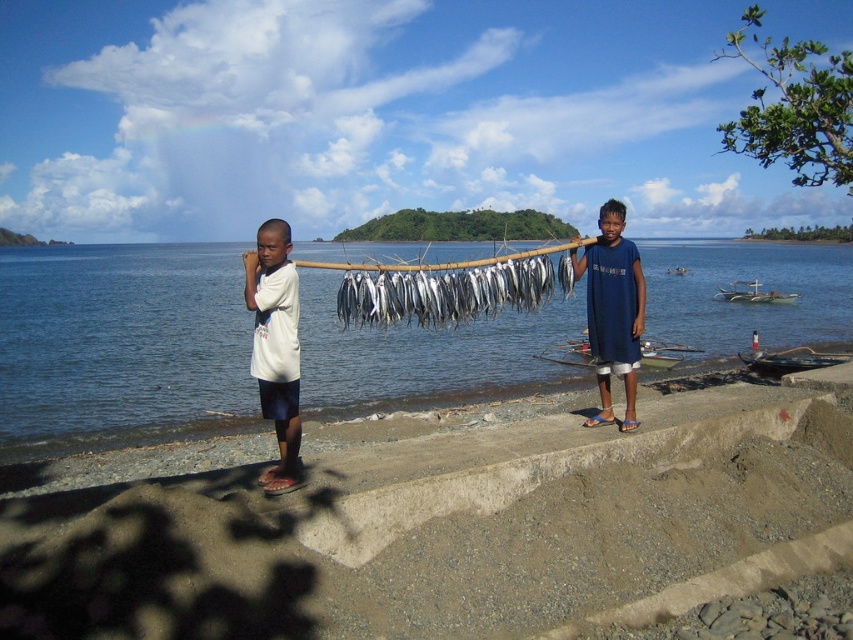
You are a photographer trying to capture the two subjects at the center of the image. You notice that the blue cotton shirt at center and the silvery metallic fish at center are both in focus. Which object occupies more horizontal space in the photo?

The blue cotton shirt at center has a larger width than the silvery metallic fish at center, so it occupies more horizontal space in the photo.